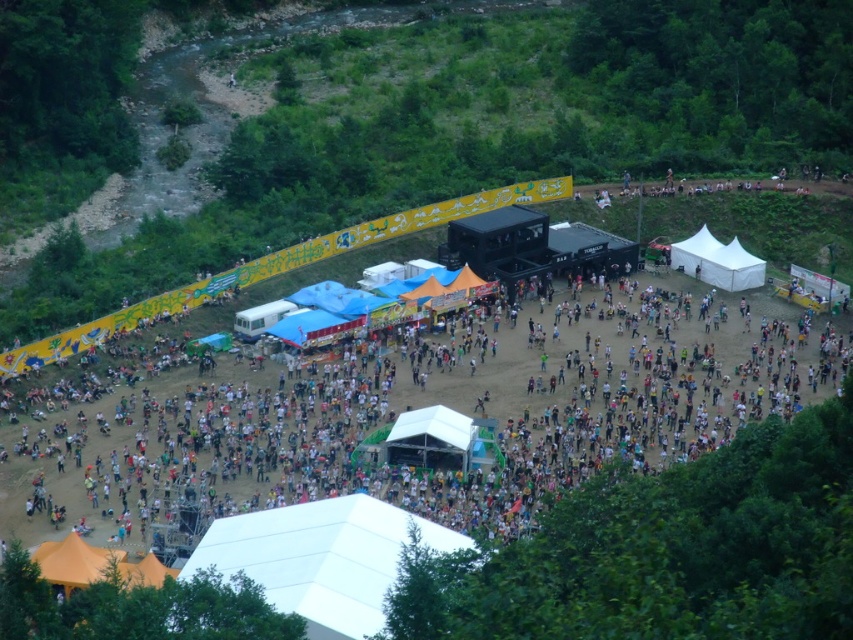
You are standing at the entrance of the event and want to locate two specific points marked on a map. The first point is labeled as point (314, 582), and the second is point (712, 269). According to the scene description, which point is closer to you when you are facing the direction of the main stage?

Point (314, 582) is closer to you because it is in front of point (712, 269) when facing the main stage.